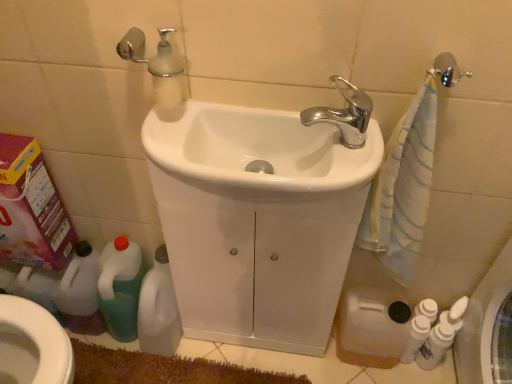
Question: From a real-world perspective, is white glossy bidet at lower left physically located above or below green plastic bottle at lower left, the 4th cleaning product positioned from the right?

Choices:
 (A) above
 (B) below

Answer: (A)

Question: In the image, is white glossy bidet at lower left on the left side or the right side of green plastic bottle at lower left, which is the first cleaning product in left-to-right order?

Choices:
 (A) right
 (B) left

Answer: (B)

Question: Estimate the real-world distances between objects in this image. Which object is closer to the green plastic bottle at lower left, the 4th cleaning product positioned from the right?

Choices:
 (A) white glossy sink at center, acting as the 1th sink starting from the back
 (B) white glossy sink at center, the second sink in the back-to-front sequence
 (C) white glossy bottles at lower right, positioned as the second cleaning product in right-to-left order
 (D) pink cardboard box at left
 (E) white glossy bidet at lower left

Answer: (D)

Question: Which object is the farthest from the green plastic bottle at lower left, which is the first cleaning product in left-to-right order?

Choices:
 (A) white glossy bottles at lower right, which ranks as the 4th cleaning product in left-to-right order
 (B) white glossy sink at center, arranged as the 2th sink when viewed from the front
 (C) white glossy bottles at lower right, which is counted as the 3th cleaning product, starting from the left
 (D) white glossy bidet at lower left
 (E) pink cardboard box at left

Answer: (A)